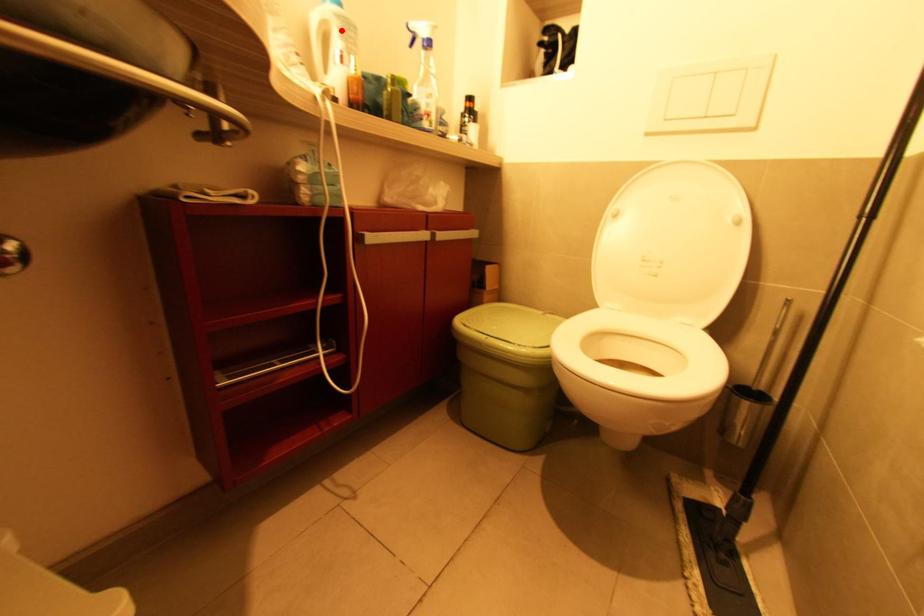
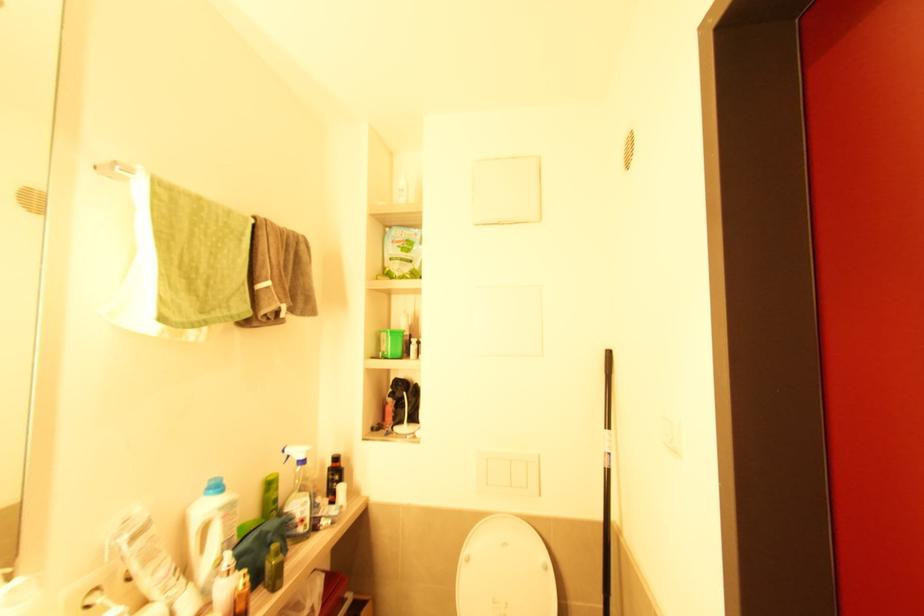
Find the pixel in the second image that matches the highlighted location in the first image.

(224, 519)